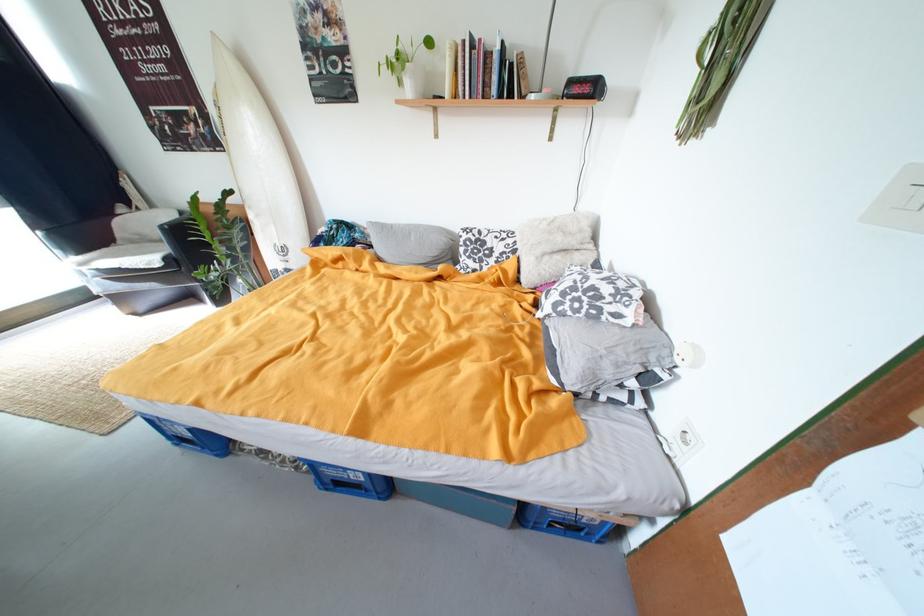
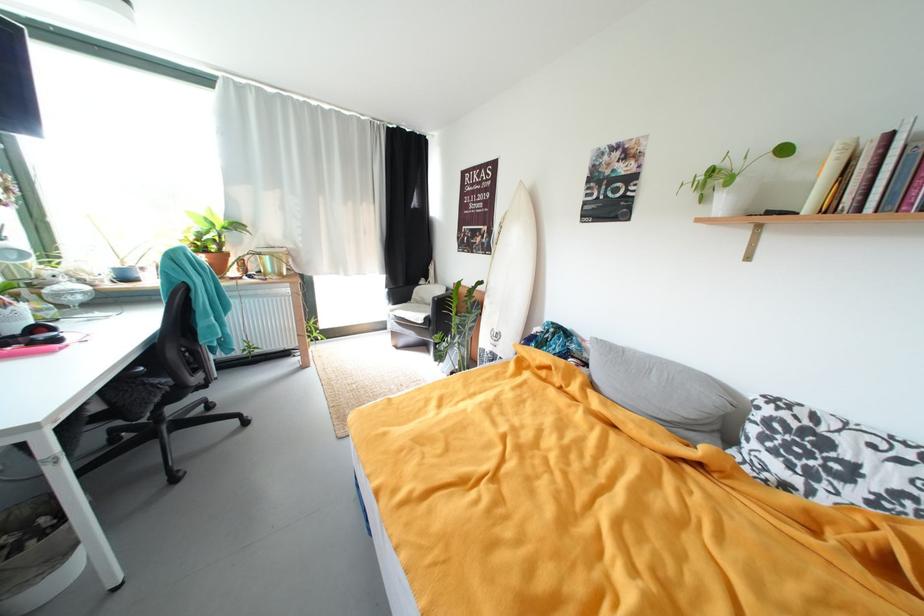
Where in the second image is the point corresponding to the point at 371,235 from the first image?

(588, 347)